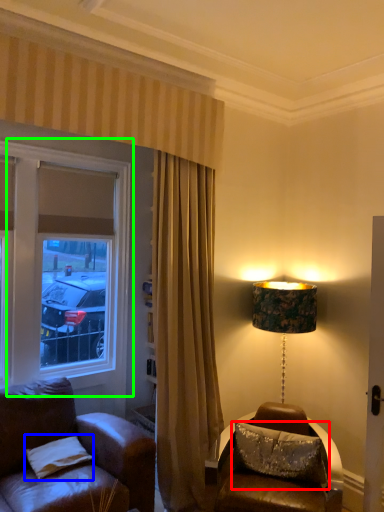
Question: Estimate the real-world distances between objects in this image. Which object is farther from pillow (highlighted by a red box), pillow (highlighted by a blue box) or window (highlighted by a green box)?

Choices:
 (A) pillow
 (B) window

Answer: (B)